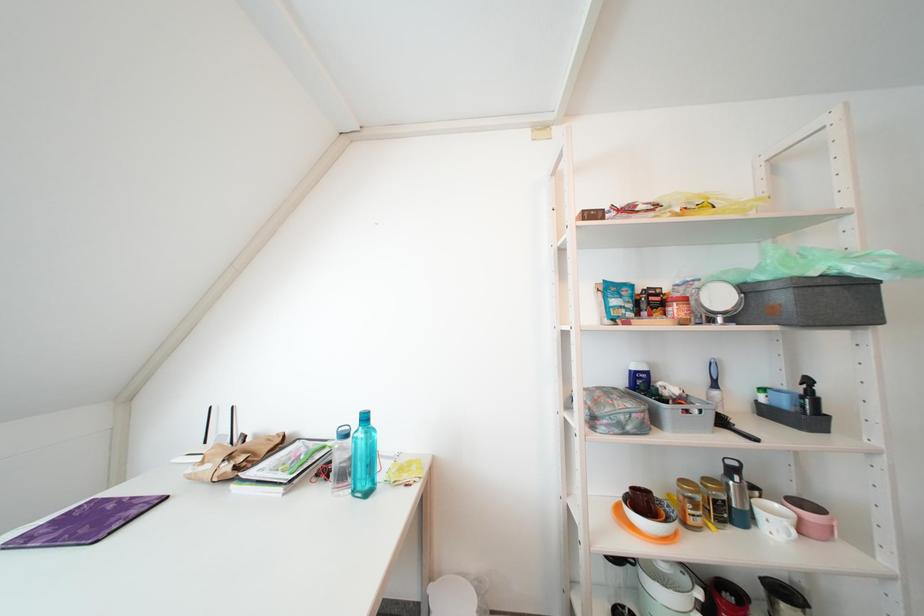
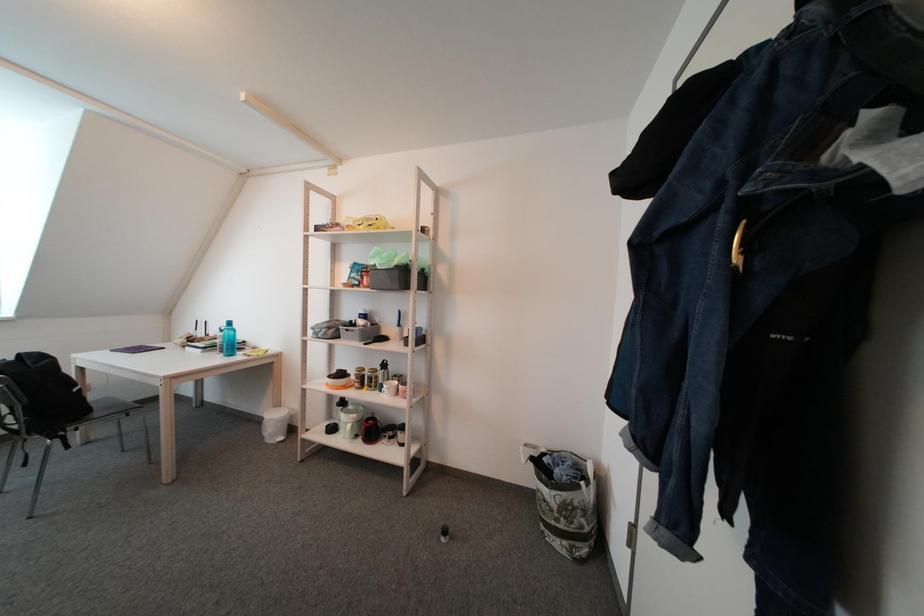
Question: The images are taken continuously from a first-person perspective. In which direction are you moving?

Choices:
 (A) Left
 (B) Right
 (C) Forward
 (D) Backward

Answer: (B)